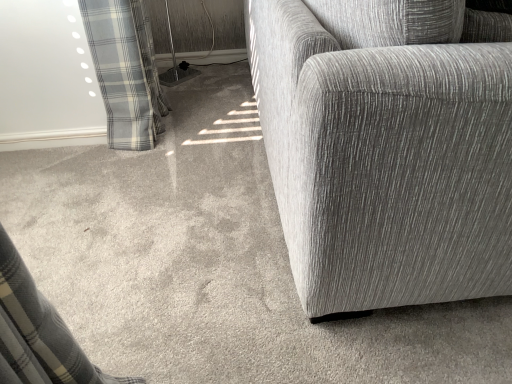
Measure the distance between point (410,142) and camera.

Point (410,142) and camera are 31.57 inches apart.

This screenshot has width=512, height=384. Identify the location of textured gray fabric couch at center. (387, 147).

What do you see at coordinates (387, 147) in the screenshot? The image size is (512, 384). I see `textured gray fabric couch at center` at bounding box center [387, 147].

I want to click on textured gray fabric couch at center, so click(387, 147).